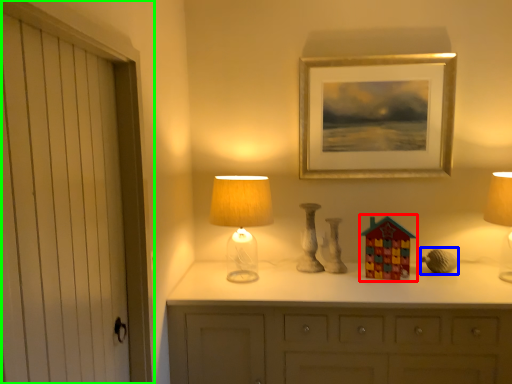
Question: Based on their relative distances, which object is farther from toy (highlighted by a red box)? Choose from miniature (highlighted by a blue box) and door (highlighted by a green box).

Choices:
 (A) miniature
 (B) door

Answer: (B)